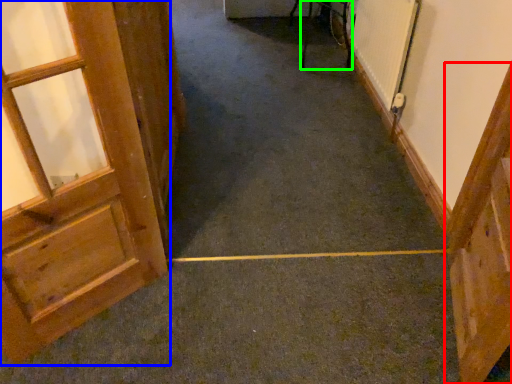
Question: Considering the real-world distances, which object is closest to door (highlighted by a red box)? door (highlighted by a blue box) or furniture (highlighted by a green box).

Choices:
 (A) door
 (B) furniture

Answer: (A)